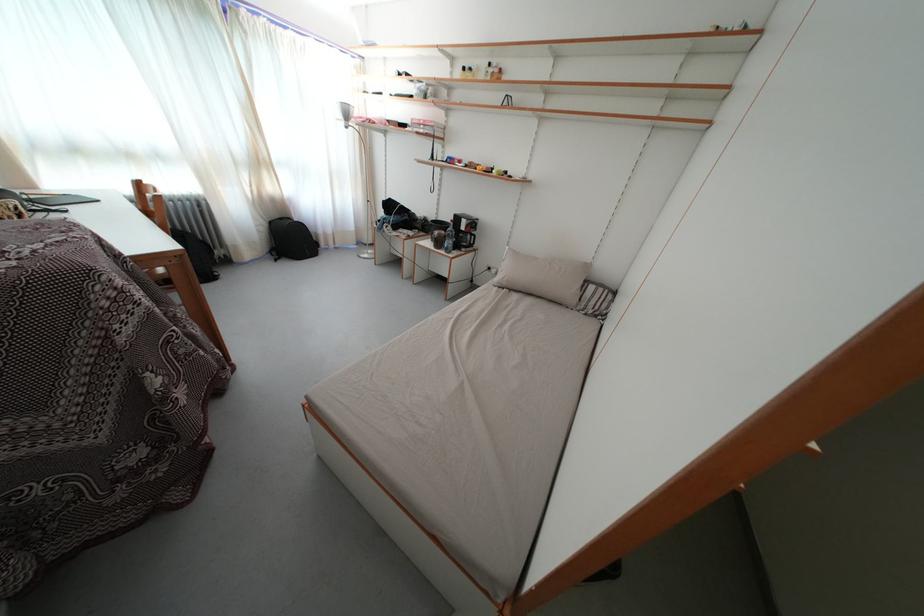
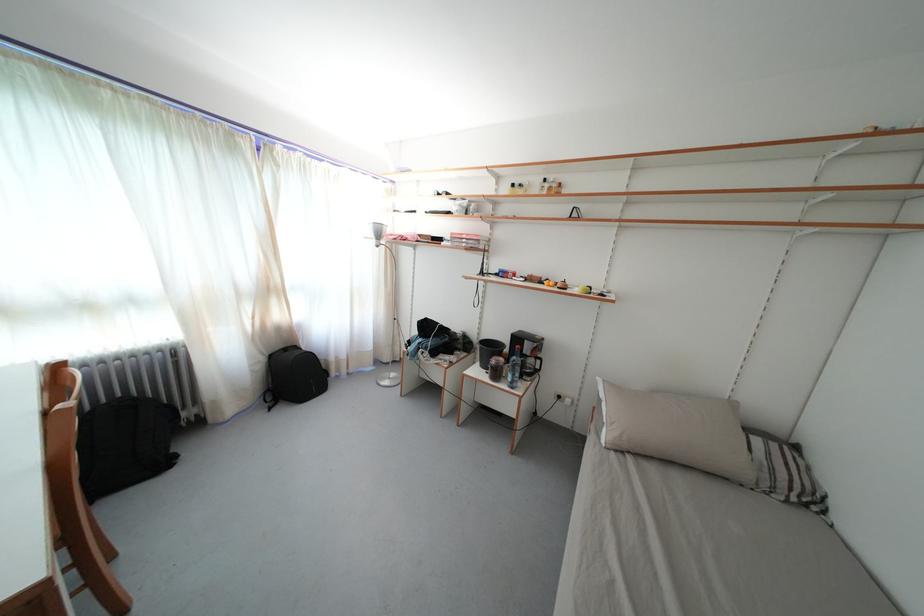
The point at (211, 249) is marked in the first image. Where is the corresponding point in the second image?

(175, 411)